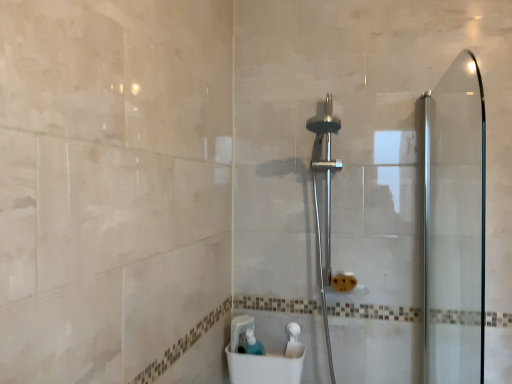
The width and height of the screenshot is (512, 384). What do you see at coordinates (455, 225) in the screenshot?
I see `transparent glass screen door at right` at bounding box center [455, 225].

This screenshot has height=384, width=512. Describe the element at coordinates (253, 344) in the screenshot. I see `translucent plastic soap dispenser at lower center` at that location.

The image size is (512, 384). I want to click on polished chrome shower head at center, so tap(327, 195).

How different are the orientations of white plastic sink at lower center and transparent glass screen door at right in degrees?

There is a 89.1-degree angle between the facing directions of white plastic sink at lower center and transparent glass screen door at right.

Considering their positions, is white plastic sink at lower center located in front of or behind transparent glass screen door at right?

In the image, white plastic sink at lower center appears behind transparent glass screen door at right.

Considering the sizes of objects white plastic sink at lower center and transparent glass screen door at right in the image provided, who is bigger, white plastic sink at lower center or transparent glass screen door at right?

With larger size is transparent glass screen door at right.

Does point (254, 357) come behind point (476, 168)?

Yes.

Are white plastic sink at lower center and polished chrome shower head at center far apart?

white plastic sink at lower center is near polished chrome shower head at center, not far away.

Would you say white plastic sink at lower center contains polished chrome shower head at center?

No, polished chrome shower head at center is not a part of white plastic sink at lower center.

Does white plastic sink at lower center appear on the right side of polished chrome shower head at center?

Incorrect, white plastic sink at lower center is not on the right side of polished chrome shower head at center.

Is transparent glass screen door at right far away from white plastic sink at lower center?

No, there isn't a large distance between transparent glass screen door at right and white plastic sink at lower center.

Would you say transparent glass screen door at right contains white plastic sink at lower center?

That's incorrect, white plastic sink at lower center is not inside transparent glass screen door at right.

Looking at this image, is transparent glass screen door at right further to camera compared to white plastic sink at lower center?

No, it is not.

Between transparent glass screen door at right and white plastic sink at lower center, which one has larger width?

white plastic sink at lower center.

Which is nearer, (329, 114) or (243, 371)?

Point (329, 114) is positioned farther from the camera compared to point (243, 371).

Which object is more forward, polished chrome shower head at center or white plastic sink at lower center?

polished chrome shower head at center is closer to the camera.

From the image's perspective, which is above, polished chrome shower head at center or white plastic sink at lower center?

polished chrome shower head at center is shown above in the image.

From the image's perspective, would you say polished chrome shower head at center is shown under transparent glass screen door at right?

Yes.

Is transparent glass screen door at right completely or partially inside polished chrome shower head at center?

That's incorrect, transparent glass screen door at right is not inside polished chrome shower head at center.

Based on the photo, from a real-world perspective, is polished chrome shower head at center positioned over transparent glass screen door at right based on gravity?

No, from a real-world perspective, polished chrome shower head at center is not over transparent glass screen door at right

Between polished chrome shower head at center and transparent glass screen door at right, which one appears on the left side from the viewer's perspective?

Positioned to the left is polished chrome shower head at center.

In the scene shown: From the image's perspective, would you say transparent glass screen door at right is shown under polished chrome shower head at center?

No, from the image's perspective, transparent glass screen door at right is not beneath polished chrome shower head at center.

Locate an element on the screen. This screenshot has width=512, height=384. screen door located in front of the polished chrome shower head at center is located at coordinates (455, 225).

Considering the sizes of objects transparent glass screen door at right and polished chrome shower head at center in the image provided, who is bigger, transparent glass screen door at right or polished chrome shower head at center?

Bigger between the two is polished chrome shower head at center.

Is translucent plastic soap dispenser at lower center positioned with its back to polished chrome shower head at center?

That's not correct — translucent plastic soap dispenser at lower center is not looking away from polished chrome shower head at center.

From a real-world perspective, which object stands above the other?

polished chrome shower head at center.

Does point (254, 352) appear closer or farther from the camera than point (313, 150)?

Point (254, 352) is positioned closer to the camera compared to point (313, 150).

You are a GUI agent. You are given a task and a screenshot of the screen. Output one action in this format:
    pyautogui.click(x=<x>, y=<y>)
    Task: Click on the sink behind the transparent glass screen door at right
    This screenshot has width=512, height=384.
    Given the screenshot: What is the action you would take?
    pyautogui.click(x=263, y=356)

Where is `shower lying on the right of white plastic sink at lower center`? This screenshot has width=512, height=384. shower lying on the right of white plastic sink at lower center is located at coordinates (327, 195).

Looking at the image, which one is located further to transparent glass screen door at right, translucent plastic soap dispenser at lower center or white plastic sink at lower center?

Among the two, translucent plastic soap dispenser at lower center is located further to transparent glass screen door at right.

Based on their spatial positions, is white plastic sink at lower center or polished chrome shower head at center closer to translucent plastic soap dispenser at lower center?

white plastic sink at lower center is closer to translucent plastic soap dispenser at lower center.

Looking at this image, looking at the image, which one is located further to translucent plastic soap dispenser at lower center, polished chrome shower head at center or transparent glass screen door at right?

Based on the image, transparent glass screen door at right appears to be further to translucent plastic soap dispenser at lower center.

From the image, which object appears to be nearer to white plastic sink at lower center, transparent glass screen door at right or polished chrome shower head at center?

polished chrome shower head at center is positioned closer to the anchor white plastic sink at lower center.

Looking at this image, looking at the image, which one is located further to white plastic sink at lower center, translucent plastic soap dispenser at lower center or polished chrome shower head at center?

polished chrome shower head at center is further to white plastic sink at lower center.

Based on their spatial positions, is translucent plastic soap dispenser at lower center or polished chrome shower head at center further from transparent glass screen door at right?

translucent plastic soap dispenser at lower center lies further to transparent glass screen door at right than the other object.

Looking at the image, which one is located further to white plastic sink at lower center, polished chrome shower head at center or transparent glass screen door at right?

transparent glass screen door at right.

Which object lies nearer to the anchor point translucent plastic soap dispenser at lower center, transparent glass screen door at right or polished chrome shower head at center?

polished chrome shower head at center is closer to translucent plastic soap dispenser at lower center.

At what (x,y) coordinates should I click in order to perform the action: click on shower between transparent glass screen door at right and translucent plastic soap dispenser at lower center from front to back. Please return your answer as a coordinate pair (x, y). Looking at the image, I should click on (327, 195).

At what (x,y) coordinates should I click in order to perform the action: click on sink located between transparent glass screen door at right and translucent plastic soap dispenser at lower center in the depth direction. Please return your answer as a coordinate pair (x, y). Looking at the image, I should click on (263, 356).

The width and height of the screenshot is (512, 384). Identify the location of shower between transparent glass screen door at right and white plastic sink at lower center from front to back. (327, 195).

At what (x,y) coordinates should I click in order to perform the action: click on toiletry between polished chrome shower head at center and white plastic sink at lower center vertically. Please return your answer as a coordinate pair (x, y). The image size is (512, 384). Looking at the image, I should click on (253, 344).